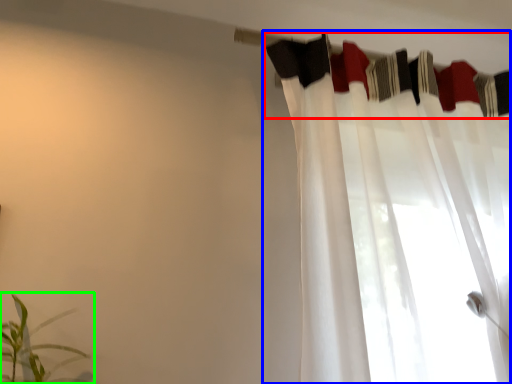
Question: Which is nearer to the clothesline (highlighted by a red box)? curtain (highlighted by a blue box) or houseplant (highlighted by a green box).

Choices:
 (A) curtain
 (B) houseplant

Answer: (A)